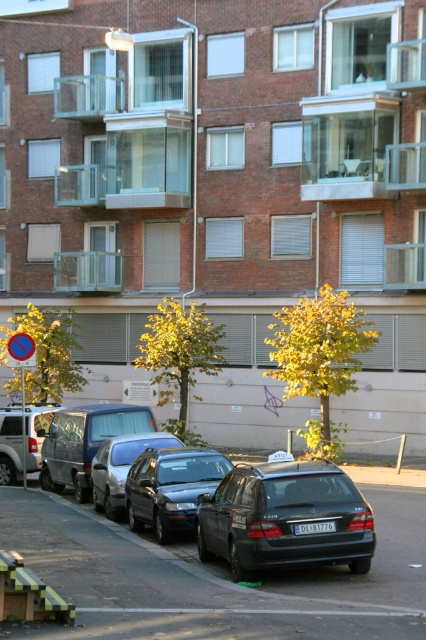
Question: Which point appears closest to the camera in this image?

Choices:
 (A) (0, 436)
 (B) (80, 428)
 (C) (22, 387)

Answer: (B)

Question: Which object appears closest to the camera in this image?

Choices:
 (A) matte black station wagon at center
 (B) matte silver van at left
 (C) silver metallic van at left
 (D) shiny black car at center

Answer: (A)

Question: Does shiny black car at center appear on the left side of silver metallic van at left?

Choices:
 (A) no
 (B) yes

Answer: (A)

Question: Which of the following is the farthest from the observer?

Choices:
 (A) (69, 435)
 (B) (104, 442)
 (C) (11, 422)

Answer: (C)

Question: Can you confirm if shiny silver sedan at center is thinner than silver metallic van at left?

Choices:
 (A) no
 (B) yes

Answer: (A)

Question: Is matte silver van at left to the left of blue plastic sign at center from the viewer's perspective?

Choices:
 (A) yes
 (B) no

Answer: (B)